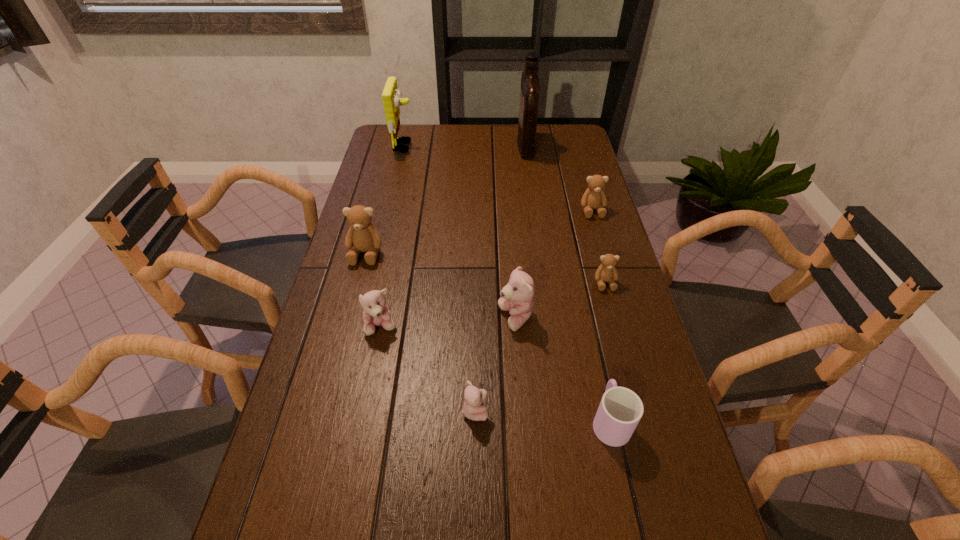
What are the coordinates of `the tallest object` in the screenshot? It's located at pyautogui.click(x=530, y=86).

This screenshot has height=540, width=960. In order to click on the fourth object from right to left in this screenshot , I will do `click(530, 86)`.

Image resolution: width=960 pixels, height=540 pixels. I want to click on the second tallest object, so click(x=391, y=96).

This screenshot has width=960, height=540. Find the location of `the fifth object from right to left`. the fifth object from right to left is located at coordinates (517, 296).

The image size is (960, 540). What are the coordinates of `the biggest pink teddy bear` in the screenshot? It's located at (x=517, y=296).

Locate an element on the screen. the leftmost brown teddy bear is located at coordinates (362, 235).

This screenshot has height=540, width=960. Find the location of `the fifth nearest teddy bear`. the fifth nearest teddy bear is located at coordinates (362, 235).

Where is `the farthest brown teddy bear`? The image size is (960, 540). the farthest brown teddy bear is located at coordinates (594, 197).

Locate an element on the screen. The width and height of the screenshot is (960, 540). the third farthest object is located at coordinates (594, 197).

You are a GUI agent. You are given a task and a screenshot of the screen. Output one action in this format:
    pyautogui.click(x=<x>, y=<y>)
    Task: Click on the second smallest pink teddy bear
    
    Given the screenshot: What is the action you would take?
    pyautogui.click(x=376, y=313)